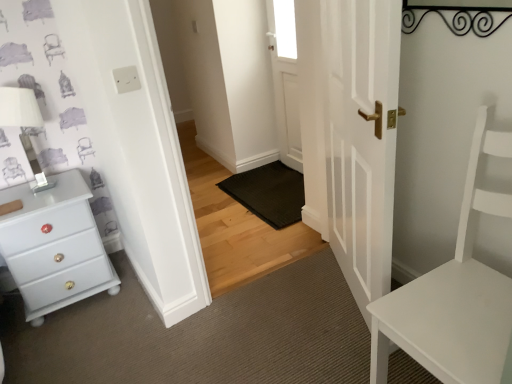
Question: In which direction should I rotate to look at white glossy door at center, positioned as the 2th door in back-to-front order?

Choices:
 (A) right
 (B) left

Answer: (A)

Question: Is transparent glass window at upper center looking in the opposite direction of white glossy door at center, positioned as the 2th door in back-to-front order?

Choices:
 (A) no
 (B) yes

Answer: (A)

Question: Is transparent glass window at upper center in contact with white glossy door at center, the 1th door positioned from the front?

Choices:
 (A) no
 (B) yes

Answer: (A)

Question: Does transparent glass window at upper center come behind white glossy door at center, positioned as the 2th door in back-to-front order?

Choices:
 (A) yes
 (B) no

Answer: (A)

Question: Is transparent glass window at upper center at the left side of white glossy door at center, the 1th door positioned from the front?

Choices:
 (A) yes
 (B) no

Answer: (A)

Question: Considering the relative positions of transparent glass window at upper center and white glossy door at center, the 1th door positioned from the front, in the image provided, is transparent glass window at upper center in front of white glossy door at center, the 1th door positioned from the front,?

Choices:
 (A) no
 (B) yes

Answer: (A)

Question: Is transparent glass window at upper center to the right of white glossy door at center, the 1th door positioned from the front, from the viewer's perspective?

Choices:
 (A) yes
 (B) no

Answer: (B)

Question: From a real-world perspective, does black rubber doormat at center sit lower than transparent glass window at upper center?

Choices:
 (A) yes
 (B) no

Answer: (A)

Question: Considering the relative sizes of black rubber doormat at center and transparent glass window at upper center in the image provided, is black rubber doormat at center taller than transparent glass window at upper center?

Choices:
 (A) no
 (B) yes

Answer: (A)

Question: Is black rubber doormat at center far from transparent glass window at upper center?

Choices:
 (A) no
 (B) yes

Answer: (A)

Question: Considering the relative positions of black rubber doormat at center and transparent glass window at upper center in the image provided, is black rubber doormat at center to the left of transparent glass window at upper center from the viewer's perspective?

Choices:
 (A) no
 (B) yes

Answer: (B)

Question: Is black rubber doormat at center closer to the viewer compared to transparent glass window at upper center?

Choices:
 (A) yes
 (B) no

Answer: (A)

Question: Does black rubber doormat at center appear on the right side of transparent glass window at upper center?

Choices:
 (A) yes
 (B) no

Answer: (B)

Question: Is matte white chest of drawers at left not near white glossy door at center, positioned as the 2th door in back-to-front order?

Choices:
 (A) yes
 (B) no

Answer: (A)